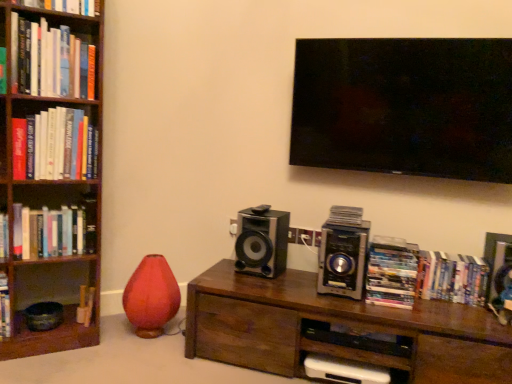
Question: Is hardcover books at center right, the 1th book from the right, positioned far away from hardcover book at upper left, arranged as the 1th book when viewed from the top?

Choices:
 (A) yes
 (B) no

Answer: (A)

Question: From the image's perspective, does hardcover books at center right, the 1th book from the right, appear lower than hardcover book at upper left, arranged as the 1th book when viewed from the top?

Choices:
 (A) yes
 (B) no

Answer: (A)

Question: Can hardcover book at upper left, the fourth book positioned from the left, be found inside hardcover books at center right, the 1th book from the right?

Choices:
 (A) no
 (B) yes

Answer: (A)

Question: Does hardcover books at center right, which appears as the 7th book when viewed from the left, come behind hardcover book at upper left, the fourth book positioned from the left?

Choices:
 (A) yes
 (B) no

Answer: (A)

Question: Considering the relative sizes of hardcover books at center right, the 1th book from the right, and hardcover book at upper left, the fourth book positioned from the left, in the image provided, is hardcover books at center right, the 1th book from the right, smaller than hardcover book at upper left, the fourth book positioned from the left,?

Choices:
 (A) yes
 (B) no

Answer: (A)

Question: Considering the positions of point (381, 322) and point (40, 220), is point (381, 322) closer or farther from the camera than point (40, 220)?

Choices:
 (A) closer
 (B) farther

Answer: (A)

Question: Considering their positions, is brown wood table at center located in front of or behind hardcover book at left, the fourth book positioned from the bottom?

Choices:
 (A) behind
 (B) front

Answer: (B)

Question: Looking at their shapes, would you say brown wood table at center is wider or thinner than hardcover book at left, the fourth book positioned from the bottom?

Choices:
 (A) thin
 (B) wide

Answer: (B)

Question: Is brown wood table at center spatially inside hardcover book at left, marked as the seventh book in a right-to-left arrangement, or outside of it?

Choices:
 (A) inside
 (B) outside

Answer: (B)

Question: Is black glossy speaker at center, placed as the first speaker when sorted from left to right, to the left or to the right of metallic silver speaker at center-right, which ranks as the 2th speaker in left-to-right order, in the image?

Choices:
 (A) right
 (B) left

Answer: (B)

Question: Is point (244, 236) positioned closer to the camera than point (344, 281)?

Choices:
 (A) closer
 (B) farther

Answer: (B)

Question: Is black glossy speaker at center, placed as the first speaker when sorted from left to right, bigger or smaller than metallic silver speaker at center-right, the 1th speaker viewed from the right?

Choices:
 (A) small
 (B) big

Answer: (A)

Question: From their relative heights in the image, would you say black glossy speaker at center, which appears as the second speaker when viewed from the right, is taller or shorter than metallic silver speaker at center-right, the 1th speaker viewed from the right?

Choices:
 (A) tall
 (B) short

Answer: (A)

Question: From a real-world perspective, is wooden bookshelf at left physically located above or below hardcover books at center right, the 1th book from the right?

Choices:
 (A) below
 (B) above

Answer: (B)

Question: Based on their sizes in the image, would you say wooden bookshelf at left is bigger or smaller than hardcover books at center right, the 2th book when ordered from bottom to top?

Choices:
 (A) small
 (B) big

Answer: (B)